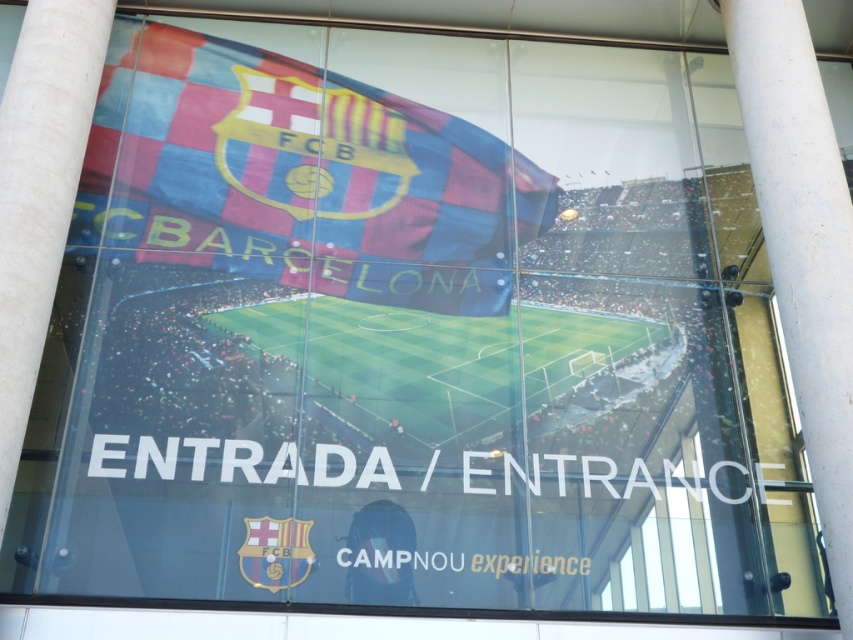
Which of these two, white glossy pillar at right or transparent glass window at center, stands shorter?

transparent glass window at center is shorter.

Does white glossy pillar at right have a greater width compared to transparent glass window at center?

No, white glossy pillar at right is not wider than transparent glass window at center.

At what (x,y) coordinates should I click in order to perform the action: click on white glossy pillar at right. Please return your answer as a coordinate pair (x, y). The width and height of the screenshot is (853, 640). Looking at the image, I should click on (804, 246).

Between polyester flag at center and transparent glass window at center, which one is positioned higher?

polyester flag at center is above.

Who is positioned more to the left, polyester flag at center or transparent glass window at center?

Positioned to the left is polyester flag at center.

Where is `polyester flag at center`? polyester flag at center is located at coordinates (300, 177).

Can you confirm if polyester flag at center is wider than white glossy pillar at right?

Yes.

Which is behind, point (74, 214) or point (788, 176)?

The point (74, 214) is more distant.

Locate an element on the screen. This screenshot has width=853, height=640. polyester flag at center is located at coordinates (300, 177).